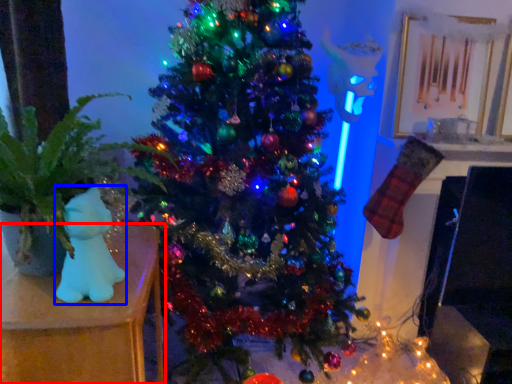
Question: Which point is further to the camera, furniture (highlighted by a red box) or toy (highlighted by a blue box)?

Choices:
 (A) furniture
 (B) toy

Answer: (B)